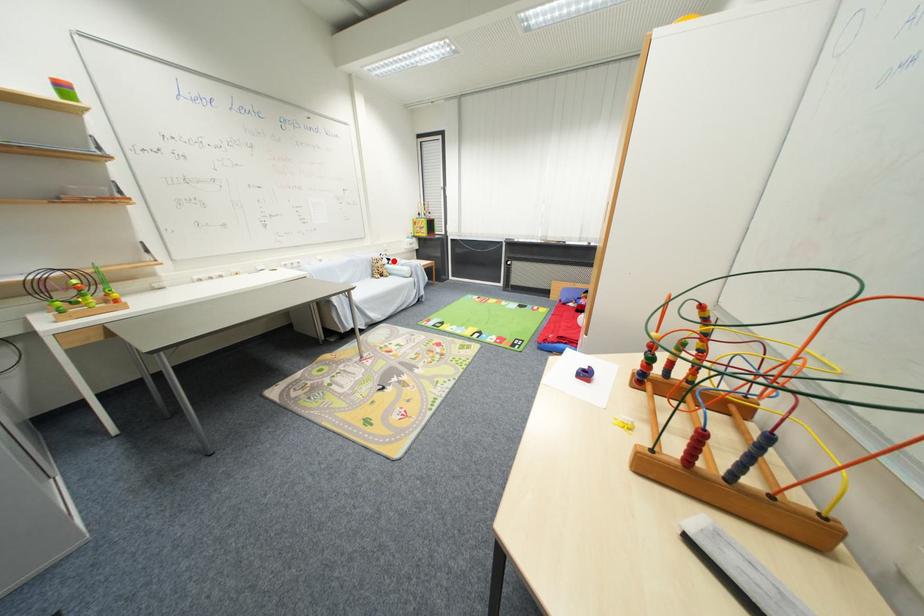
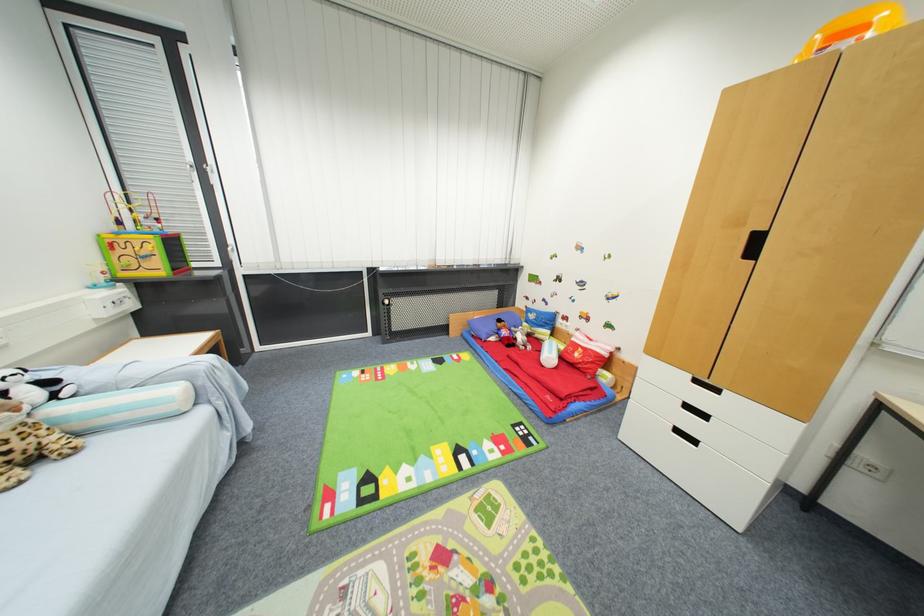
Find the pixel in the second image that matches the highlighted location in the first image.

(54, 384)